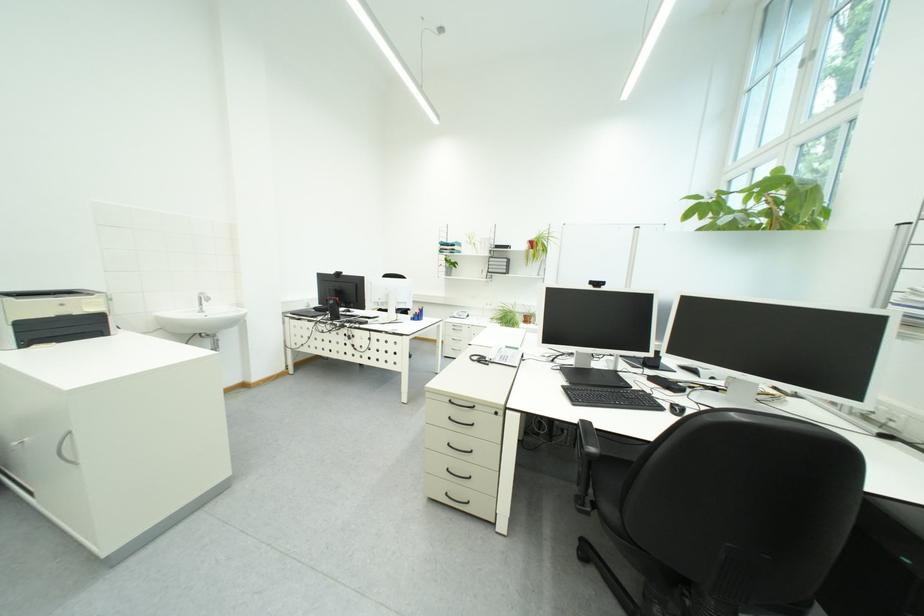
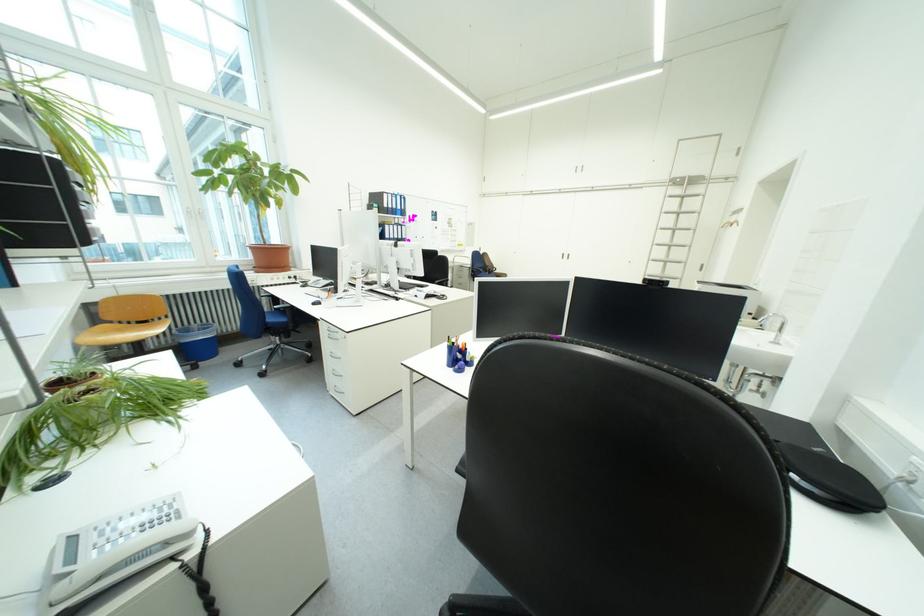
Question: I am providing you with two images of the same scene from different viewpoints. Please identify which objects are invisible in image2.

Choices:
 (A) clear plastic lid
 (B) window handle
 (C) black chair armrest
 (D) telephone handset

Answer: (C)